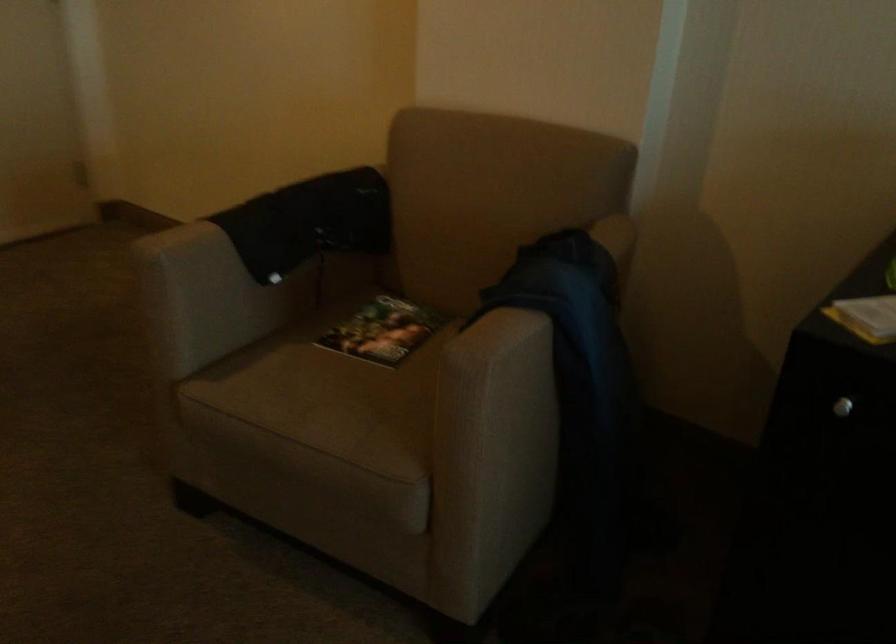
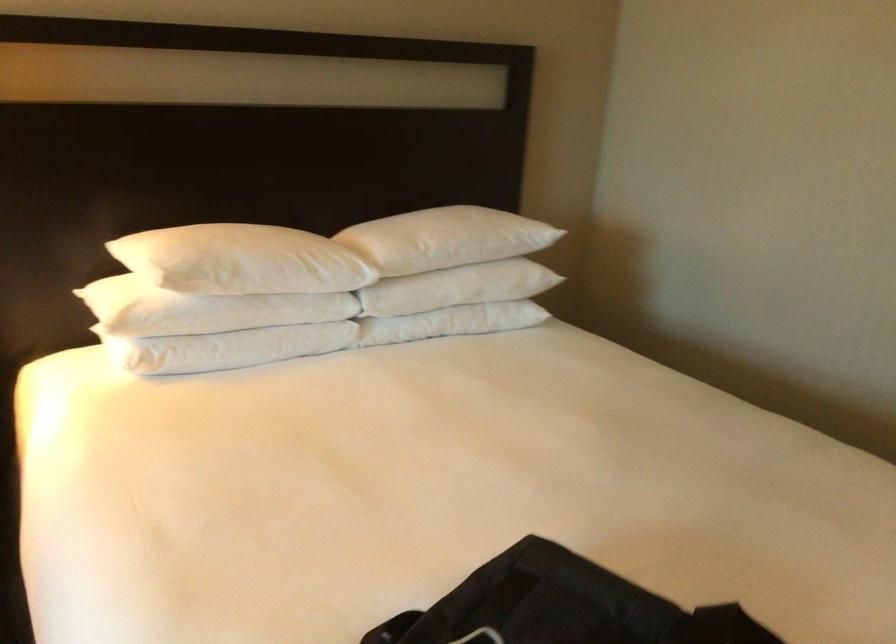
The first image is from the beginning of the video and the second image is from the end. How did the camera likely rotate when shooting the video?

The rotation direction of the camera is left-down.